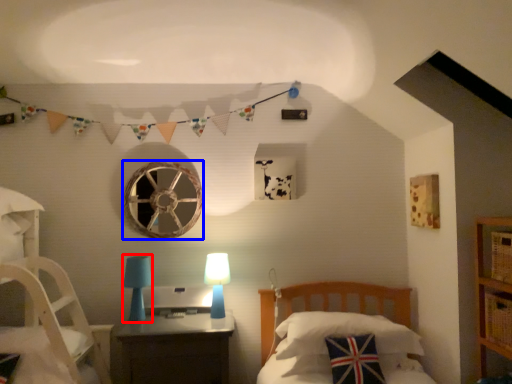
Question: Which object is closer to the camera taking this photo, table lamp (highlighted by a red box) or oval (highlighted by a blue box)?

Choices:
 (A) table lamp
 (B) oval

Answer: (A)